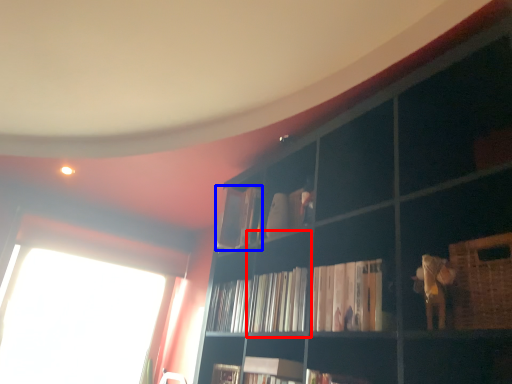
Question: Which of the following is the farthest to the observer, cabinet (highlighted by a red box) or book (highlighted by a blue box)?

Choices:
 (A) cabinet
 (B) book

Answer: (B)